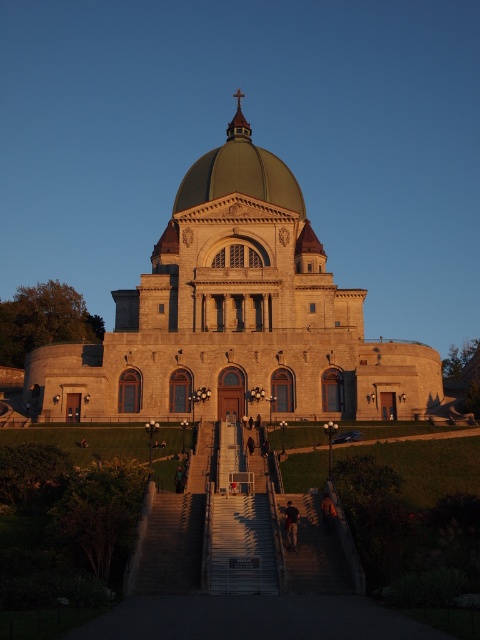
Question: Is stone church at center thinner than green matte dome at center?

Choices:
 (A) no
 (B) yes

Answer: (A)

Question: Among these points, which one is farthest from the camera?

Choices:
 (A) (282, 176)
 (B) (288, 522)

Answer: (A)

Question: Considering the real-world distances, which object is farthest from the green matte dome at center?

Choices:
 (A) stone church at center
 (B) dark blue jeans at center

Answer: (B)

Question: Does stone church at center have a lesser width compared to dark blue jeans at center?

Choices:
 (A) no
 (B) yes

Answer: (A)

Question: Among these points, which one is farthest from the camera?

Choices:
 (A) (232, 157)
 (B) (197, 362)
 (C) (296, 531)

Answer: (A)

Question: Is stone church at center to the left of dark blue jeans at center from the viewer's perspective?

Choices:
 (A) no
 (B) yes

Answer: (B)